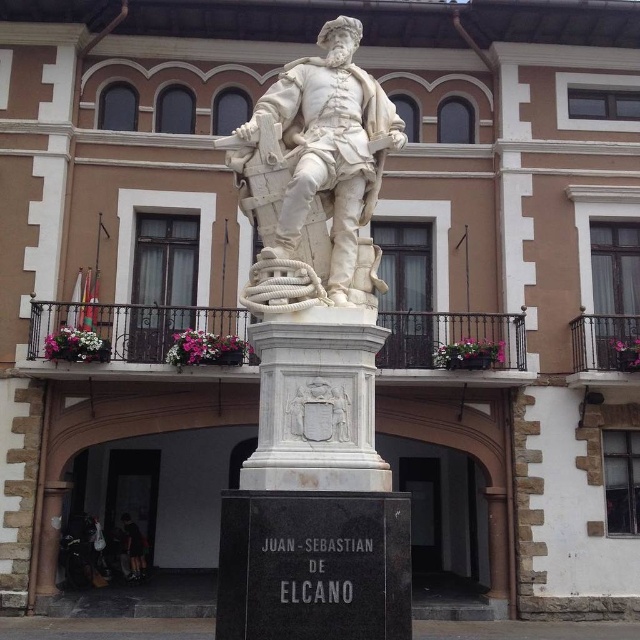
Question: Among these objects, which one is nearest to the camera?

Choices:
 (A) dark blue jeans at lower left
 (B) white marble statue at center

Answer: (B)

Question: From the image, what is the correct spatial relationship of white marble pedestal at center in relation to dark blue jeans at lower left?

Choices:
 (A) below
 (B) above

Answer: (B)

Question: Can you confirm if white marble pedestal at center is smaller than dark blue jeans at lower left?

Choices:
 (A) yes
 (B) no

Answer: (B)

Question: Among these points, which one is nearest to the camera?

Choices:
 (A) (301, 129)
 (B) (134, 545)

Answer: (A)

Question: Based on their relative distances, which object is nearer to the dark blue jeans at lower left?

Choices:
 (A) white marble pedestal at center
 (B) white marble statue at center

Answer: (A)

Question: Considering the relative positions of white marble pedestal at center and dark blue jeans at lower left in the image provided, where is white marble pedestal at center located with respect to dark blue jeans at lower left?

Choices:
 (A) left
 (B) right

Answer: (B)